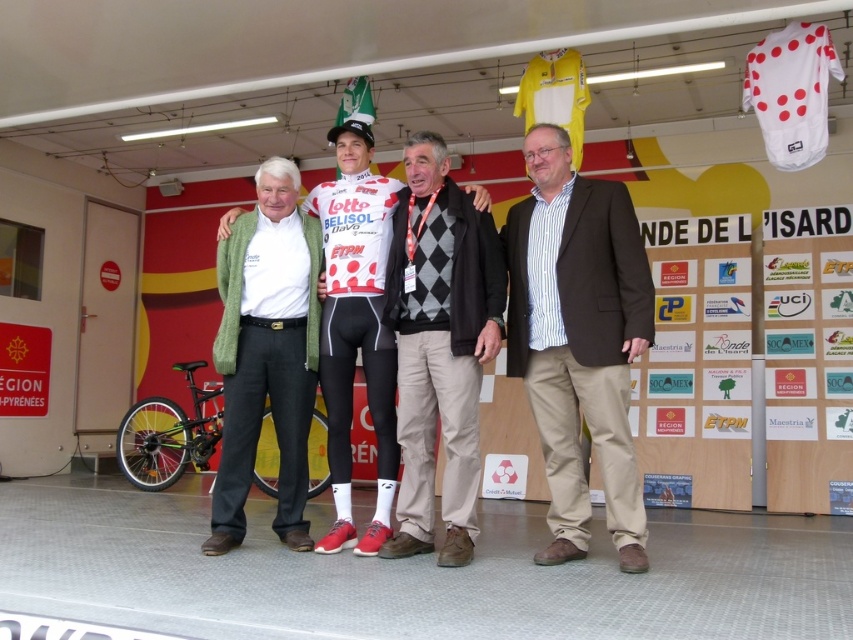
You are a photographer at the event and need to capture a photo where both the brown textured blazer at center and the white jersey at center are visible. Given their heights, which one might you need to adjust your camera angle to ensure both are fully captured?

The brown textured blazer at center is not as tall as the white jersey at center, so you might need to tilt the camera slightly upward to ensure the taller white jersey at center is fully visible while still capturing the shorter brown textured blazer at center.

What is located at the coordinate point (265, 355) in the image?

The green wool sweater at left is located at the coordinate point (265, 355).